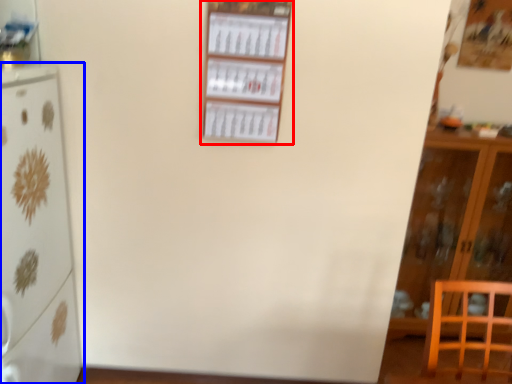
Question: Among these objects, which one is nearest to the camera, shelf (highlighted by a red box) or refrigerator (highlighted by a blue box)?

Choices:
 (A) shelf
 (B) refrigerator

Answer: (B)